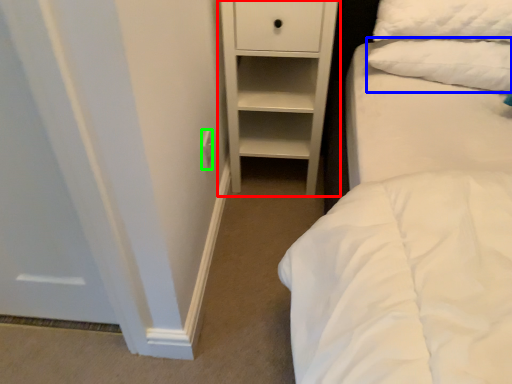
Question: Which object is the closest to the chest of drawers (highlighted by a red box)? Choose among these: pillow (highlighted by a blue box) or electric outlet (highlighted by a green box).

Choices:
 (A) pillow
 (B) electric outlet

Answer: (A)